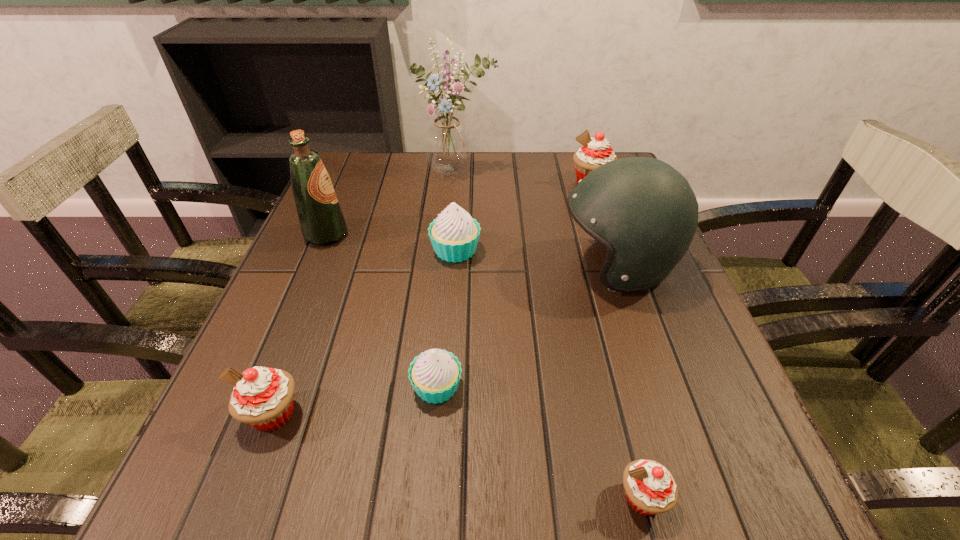
This screenshot has width=960, height=540. Identify the location of the smaller white cupcake. (435, 374).

In order to click on the nearest pink cupcake in this screenshot , I will do `click(650, 488)`.

Locate an element on the screen. The image size is (960, 540). the smallest pink cupcake is located at coordinates (650, 488).

Where is `vacant space situated on the front-facing side of the tallest object`? vacant space situated on the front-facing side of the tallest object is located at coordinates coord(449,260).

In order to click on vacant space situated 0.350m on the front-facing side of the green olive oil in this screenshot , I will do `click(504, 234)`.

In order to click on free region located at the face opening of the football helmet in this screenshot , I will do `click(395, 266)`.

The height and width of the screenshot is (540, 960). What are the coordinates of `vacant space located 0.290m at the face opening of the football helmet` in the screenshot? It's located at click(x=419, y=266).

The image size is (960, 540). I want to click on vacant space positioned at the face opening of the football helmet, so click(x=505, y=266).

Locate an element on the screen. vacant position located on the left of the biggest pink cupcake is located at coordinates (447, 182).

At what (x,y) coordinates should I click in order to perform the action: click on blank space located 0.210m on the front of the farther white cupcake. Please return your answer as a coordinate pair (x, y). The height and width of the screenshot is (540, 960). Looking at the image, I should click on (449, 349).